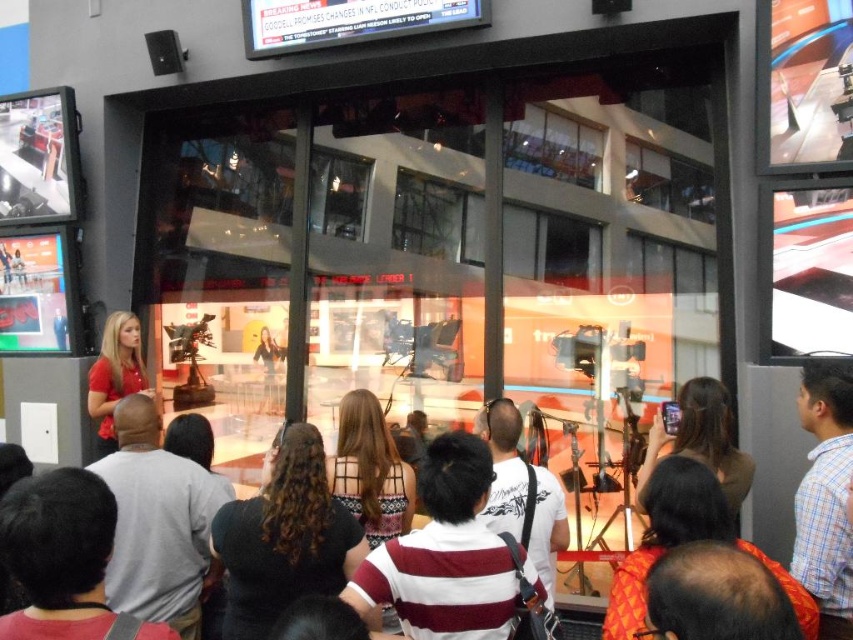
Is point (274, 563) closer to camera compared to point (714, 394)?

Yes.

Can you confirm if black fabric at center is positioned to the right of brown leather jacket at center?

In fact, black fabric at center is to the left of brown leather jacket at center.

The height and width of the screenshot is (640, 853). Describe the element at coordinates (283, 538) in the screenshot. I see `black fabric at center` at that location.

I want to click on black fabric at center, so click(x=283, y=538).

In the scene shown: Is striped cotton shirt at center behind matte red shirt at center?

No.

Image resolution: width=853 pixels, height=640 pixels. Describe the element at coordinates (444, 554) in the screenshot. I see `striped cotton shirt at center` at that location.

Find the location of a particular element. This screenshot has width=853, height=640. striped cotton shirt at center is located at coordinates (444, 554).

Is striped cotton shirt at center taller than white striped shirt at center?

No.

Between point (368, 557) and point (547, 595), which one is positioned in front?

Positioned in front is point (368, 557).

The image size is (853, 640). I want to click on striped cotton shirt at center, so click(444, 554).

What are the coordinates of `striped cotton shirt at center` in the screenshot? It's located at click(x=444, y=554).